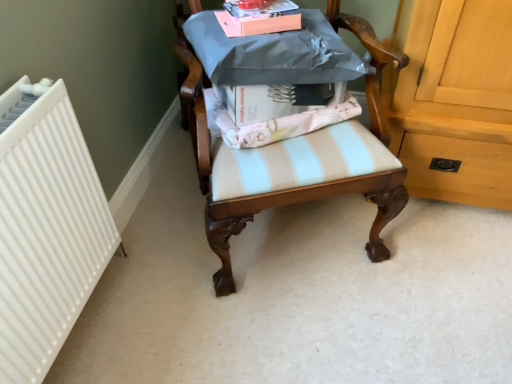
The width and height of the screenshot is (512, 384). What are the coordinates of `vacant space to the left of wooden chair at center` in the screenshot? It's located at (159, 253).